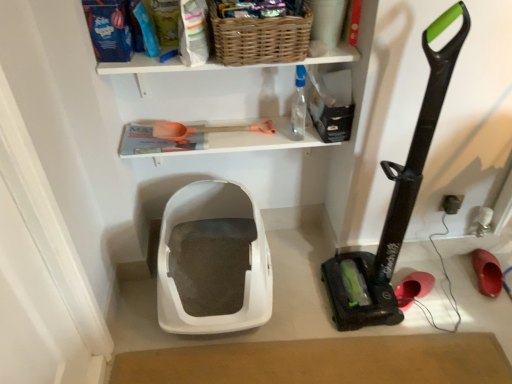
Question: From a real-world perspective, is transparent plastic bottle at upper center physically located above or below black plastic electric outlet at lower right?

Choices:
 (A) above
 (B) below

Answer: (A)

Question: In terms of width, does transparent plastic bottle at upper center look wider or thinner when compared to black plastic electric outlet at lower right?

Choices:
 (A) thin
 (B) wide

Answer: (B)

Question: Estimate the real-world distances between objects in this image. Which object is farther from the woven brown basket at upper center?

Choices:
 (A) rubberized red shoe at lower right, the first footwear from the left
 (B) transparent plastic bottle at upper center
 (C) black plastic electric outlet at lower right
 (D) orange plastic shovel at upper center
 (E) white plastic litter box at center

Answer: (A)

Question: Based on their relative distances, which object is farther from the woven brown basket at upper center?

Choices:
 (A) black plastic vacuum cleaner at right
 (B) rubber matte shoe at lower right, which is the first footwear from right to left
 (C) white plastic litter box at center
 (D) rubberized red shoe at lower right, the second footwear from the right
 (E) white wicker basket at upper center

Answer: (B)